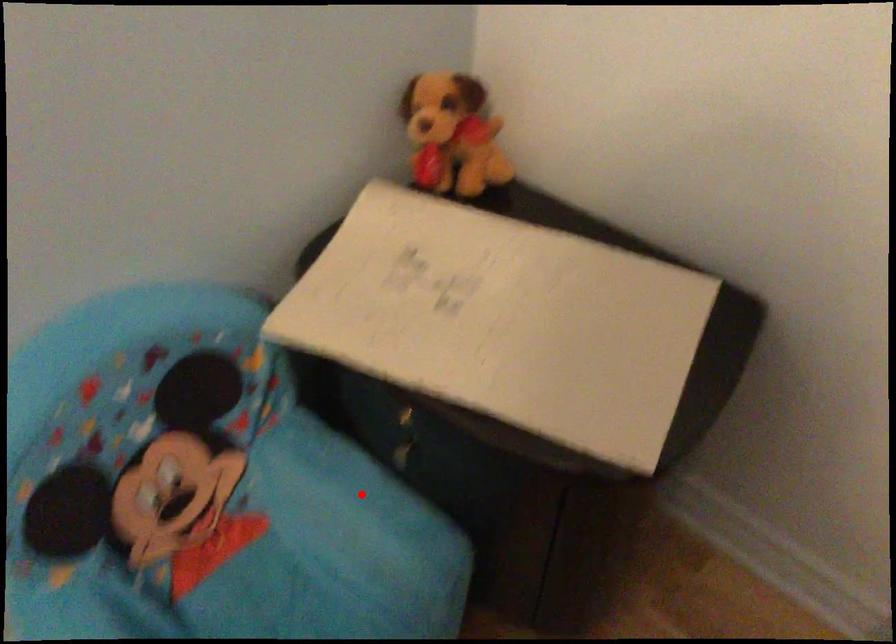
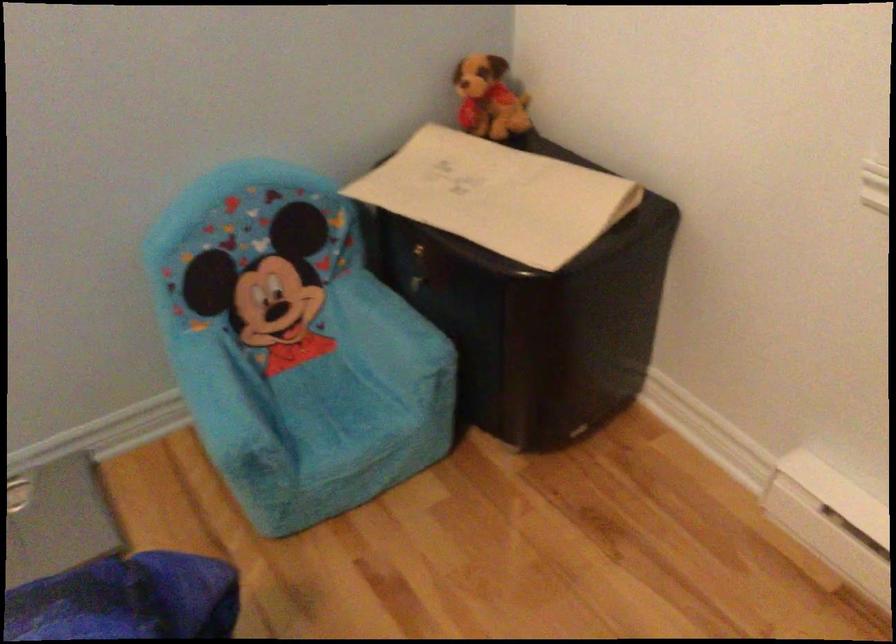
The point at the highlighted location is marked in the first image. Where is the corresponding point in the second image?

(389, 316)